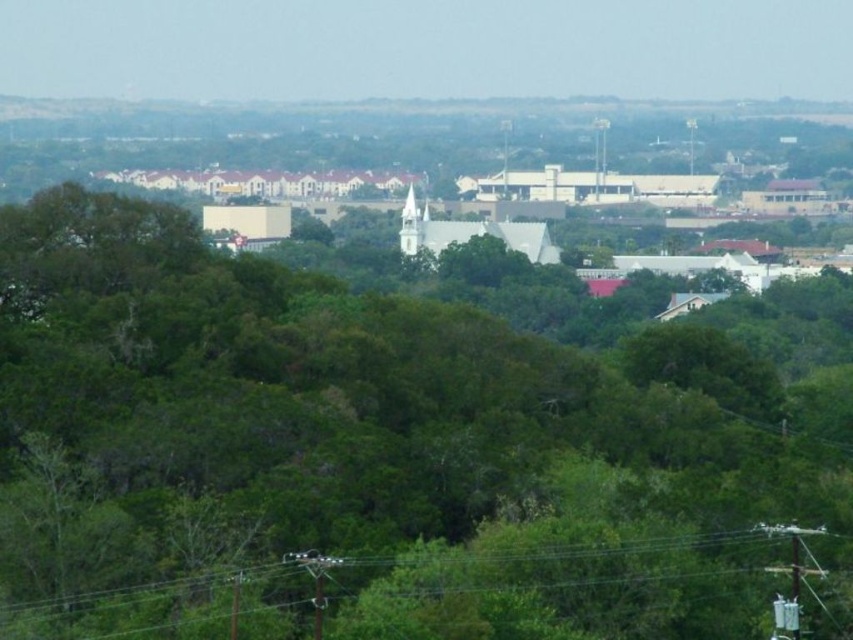
In the scene shown: You are a bird flying over the suburban area and want to land on the tallest object between the green leafy tree at center and the green wire at lower center. Which one should you choose?

The green leafy tree at center is larger in size than the green wire at lower center, so you should choose the green leafy tree at center to land on as it is taller.

Consider the image. You are a drone operator trying to navigate a drone through the suburban area shown. You need to fly the drone from the green wire at lower center to the green leafy tree at center. Based on the scene description, can you safely ascend vertically without hitting any obstacles?

The green leafy tree at center is located above the green wire at lower center. Since the tree is above the wire, ascending vertically from the green wire at lower center towards the green leafy tree at center would require passing under the tree, so there might be branches or foliage to avoid. However, the vertical path is clear as the tree is above, but caution is needed to avoid collisions with the tree itself.

You are standing at the point labeled as point (392, 451) in the image, which is located at the center. Looking around, what do you see immediately around you?

You are standing at point (392, 451), which is a green leafy tree at center. Immediately around you, you would see the dense foliage and branches of the tree, as well as the surrounding forested area described in the scene.